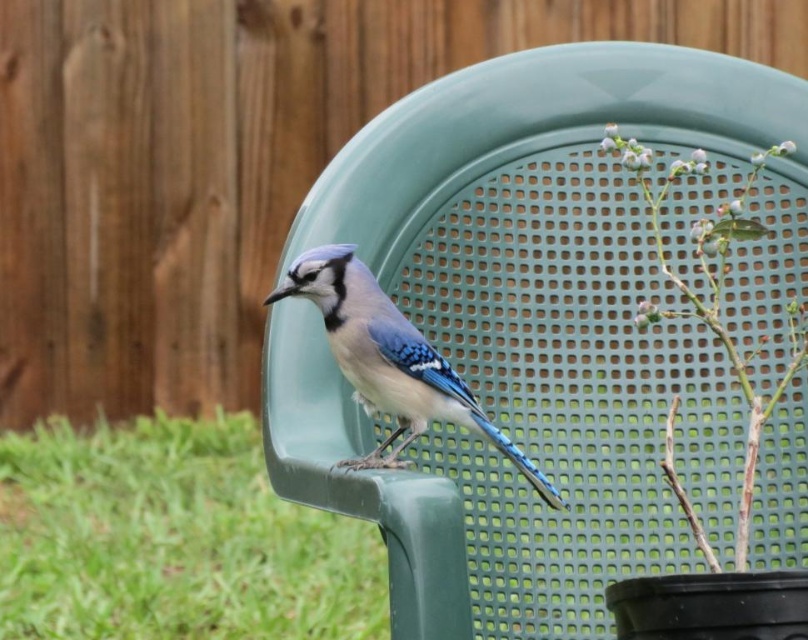
Question: Among these points, which one is nearest to the camera?

Choices:
 (A) (171, 451)
 (B) (421, 364)

Answer: (B)

Question: Can you confirm if green plastic chair at center is wider than green matte plant at center right?

Choices:
 (A) no
 (B) yes

Answer: (B)

Question: Which of these objects is positioned farthest from the green plastic chair at center?

Choices:
 (A) green matte plant at center right
 (B) blue glossy bird at center

Answer: (B)

Question: Does green plastic chair at center have a greater width compared to blue glossy bird at center?

Choices:
 (A) no
 (B) yes

Answer: (B)

Question: Which point is closer to the camera?

Choices:
 (A) (194, 541)
 (B) (379, 406)

Answer: (B)

Question: Is green plastic chair at center closer to camera compared to blue glossy bird at center?

Choices:
 (A) no
 (B) yes

Answer: (A)